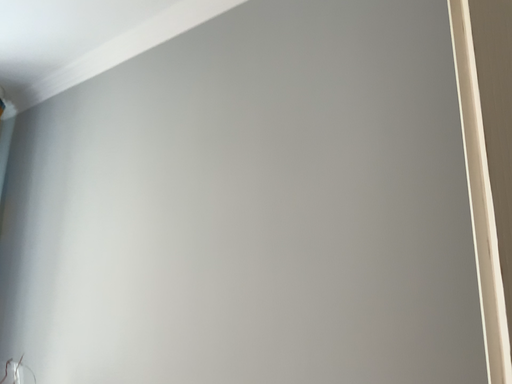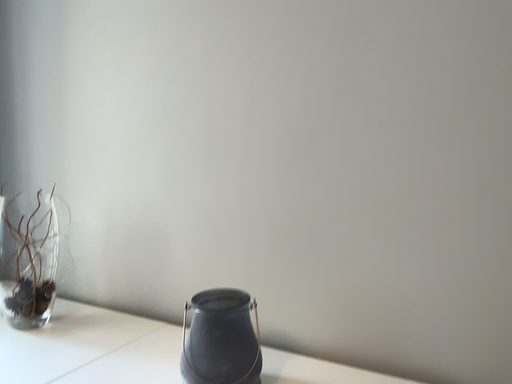
Question: How did the camera likely rotate when shooting the video?

Choices:
 (A) rotated downward
 (B) rotated upward

Answer: (A)